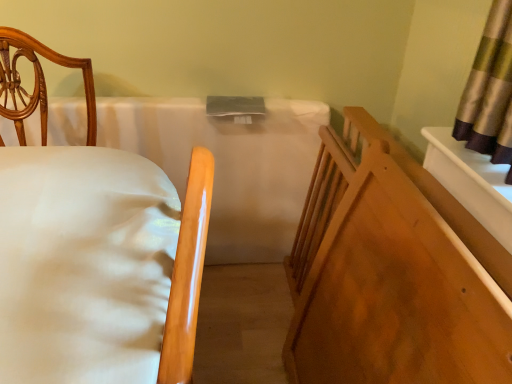
Question: Is white fabric bed at left to the right of white smooth mattress at center from the viewer's perspective?

Choices:
 (A) yes
 (B) no

Answer: (A)

Question: From a real-world perspective, is white fabric bed at left located beneath white smooth mattress at center?

Choices:
 (A) no
 (B) yes

Answer: (A)

Question: Can you confirm if white fabric bed at left is smaller than white smooth mattress at center?

Choices:
 (A) no
 (B) yes

Answer: (A)

Question: From a real-world perspective, is white fabric bed at left on top of white smooth mattress at center?

Choices:
 (A) no
 (B) yes

Answer: (B)

Question: Is white fabric bed at left looking in the opposite direction of white smooth mattress at center?

Choices:
 (A) yes
 (B) no

Answer: (B)

Question: Is white fabric bed at left touching white smooth mattress at center?

Choices:
 (A) no
 (B) yes

Answer: (A)

Question: Would you say white smooth mattress at center is a long distance from smooth wood crib at right?

Choices:
 (A) no
 (B) yes

Answer: (A)

Question: From a real-world perspective, is white smooth mattress at center over smooth wood crib at right?

Choices:
 (A) no
 (B) yes

Answer: (A)

Question: Is white smooth mattress at center bigger than smooth wood crib at right?

Choices:
 (A) no
 (B) yes

Answer: (B)

Question: Can smooth wood crib at right be found inside white smooth mattress at center?

Choices:
 (A) no
 (B) yes

Answer: (A)

Question: Is white smooth mattress at center further to the viewer compared to smooth wood crib at right?

Choices:
 (A) no
 (B) yes

Answer: (B)

Question: Is smooth wood crib at right at the back of white smooth mattress at center?

Choices:
 (A) no
 (B) yes

Answer: (A)

Question: Does smooth wood crib at right have a lesser height compared to white smooth mattress at center?

Choices:
 (A) no
 (B) yes

Answer: (B)